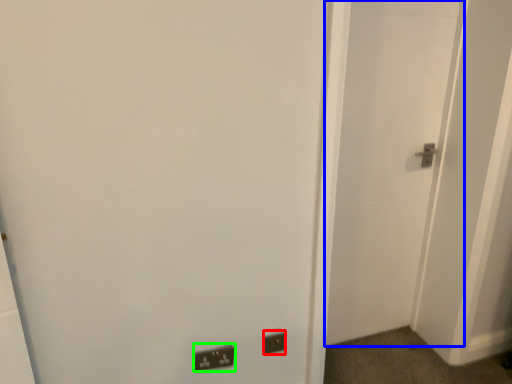
Question: Estimate the real-world distances between objects in this image. Which object is farther from electric outlet (highlighted by a red box), door (highlighted by a blue box) or light switch (highlighted by a green box)?

Choices:
 (A) door
 (B) light switch

Answer: (A)